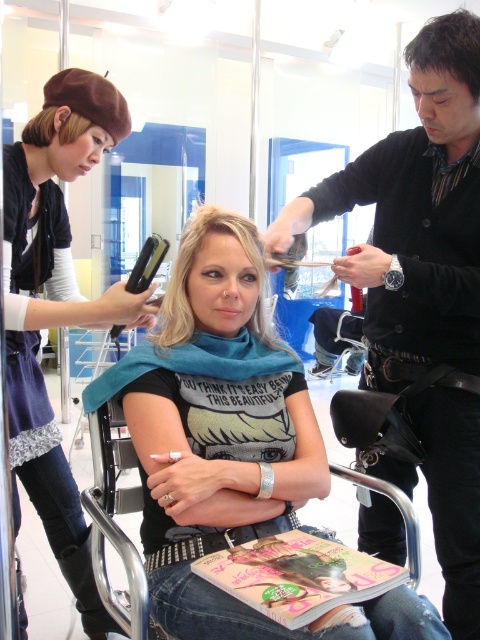
You are a customer in the hair salon. You want to know if the matte black shirt at center can be seen from the dark brown hair at upper right. Can you determine this based on their positions?

The matte black shirt at center might be wider than dark brown hair at upper right, so it is possible that the matte black shirt at center could block the view from the dark brown hair at upper right depending on their exact positions and angles.

You are a customer in the salon and want to know if the black leather belt at upper right can be placed next to the matte brown hair at upper left without overlapping. Based on their sizes, is this possible?

The black leather belt at upper right is wider than the matte brown hair at upper left, so placing them next to each other without overlapping is possible as there is enough space between them.